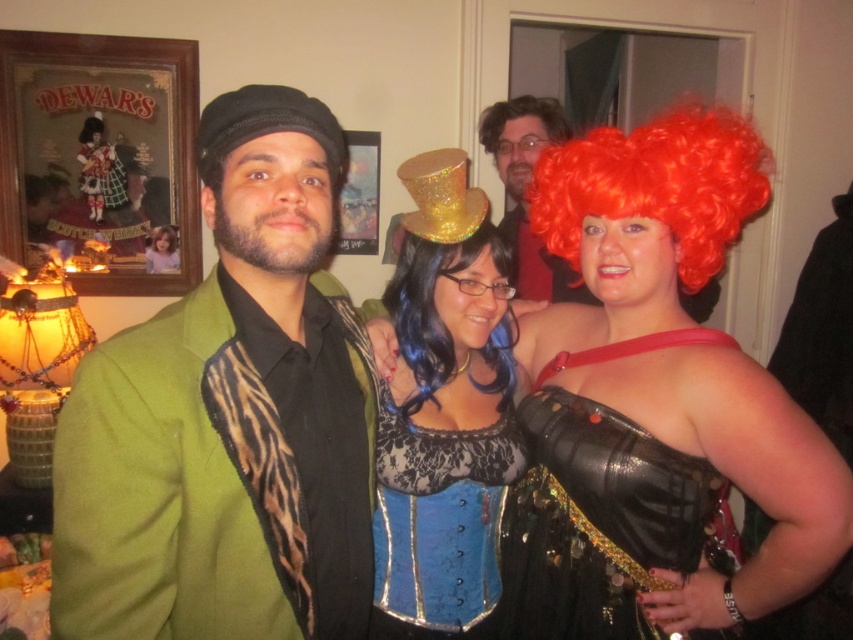
You are at a party and want to take a photo with the person at point (x=549, y=369). If your camera has a maximum focus range of 1.5 meters, will you be able to capture them clearly?

The distance between you and the person at point (x=549, y=369) is 1.33 meters, which is within the camera maximum focus range of 1.5 meters. So yes, you can capture them clearly.

You are at a costume party and need to take a photo with two friends. You notice the blue lace corset at center and the fluffy red wig at upper center. Which of these items is positioned closer to the camera in the photo?

The blue lace corset at center is positioned closer to the camera than the fluffy red wig at upper center because it is in front of it.